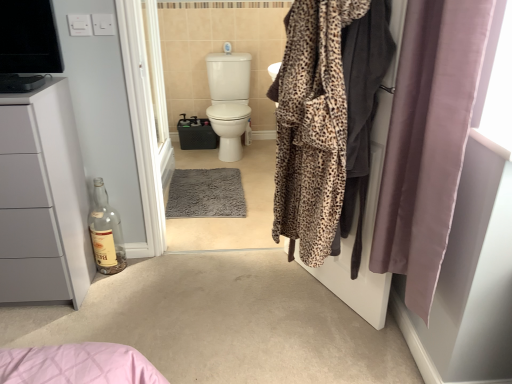
Describe the element at coordinates (42, 197) in the screenshot. I see `matte white cabinet at left` at that location.

In order to click on matte white cabinet at left in this screenshot , I will do `click(42, 197)`.

What are the coordinates of `white glossy screen door at center, acting as the second screen door starting from the front` in the screenshot? It's located at (146, 118).

At what (x,y) coordinates should I click in order to perform the action: click on leopard print robe at center, the first screen door in the right-to-left sequence. Please return your answer as a coordinate pair (x, y). This screenshot has height=384, width=512. Looking at the image, I should click on (x=362, y=242).

You are a GUI agent. You are given a task and a screenshot of the screen. Output one action in this format:
    pyautogui.click(x=<x>, y=<y>)
    Task: Click on the bathroom cabinet below the leopard print robe at center, the second screen door when ordered from back to front (from a real-world perspective)
    This screenshot has width=512, height=384.
    Given the screenshot: What is the action you would take?
    pyautogui.click(x=42, y=197)

Which of these two, matte white cabinet at left or leopard print robe at center, the first screen door in the right-to-left sequence, stands shorter?

matte white cabinet at left.

Which is more distant, (23, 129) or (350, 241)?

The point (350, 241) is farther from the camera.

Is matte white cabinet at left situated inside leopard print robe at center, positioned as the first screen door in front-to-back order, or outside?

matte white cabinet at left is not inside leopard print robe at center, positioned as the first screen door in front-to-back order, it's outside.

Is clear glass bottle at lower left not near white glossy toilet at center?

Yes.

Between clear glass bottle at lower left and white glossy toilet at center, which one has more height?

Standing taller between the two is white glossy toilet at center.

How much distance is there between clear glass bottle at lower left and white glossy toilet at center?

They are 1.90 meters apart.

Between clear glass bottle at lower left and white glossy toilet at center, which one has larger width?

With larger width is white glossy toilet at center.

Which is more to the left, matte white cabinet at left or white glossy screen door at center, marked as the 2th screen door in a right-to-left arrangement?

matte white cabinet at left is more to the left.

From a real-world perspective, count 1st screen doors upward from the matte white cabinet at left and point to it. Please provide its 2D coordinates.

[(146, 118)]

From the image's perspective, is matte white cabinet at left located above white glossy screen door at center, marked as the 2th screen door in a right-to-left arrangement?

No.

Is matte white cabinet at left not close to white glossy screen door at center, the first screen door when ordered from back to front?

No, matte white cabinet at left is in close proximity to white glossy screen door at center, the first screen door when ordered from back to front.

Between leopard print robe at center, positioned as the first screen door in front-to-back order, and leopard print robe at right, which one has less height?

leopard print robe at center, positioned as the first screen door in front-to-back order.

Is leopard print robe at center, the second screen door when ordered from back to front, to the right of leopard print robe at right from the viewer's perspective?

Answer: In fact, leopard print robe at center, the second screen door when ordered from back to front, is to the left of leopard print robe at right.

The width and height of the screenshot is (512, 384). Find the location of `clothing below the leopard print robe at center, which is the second screen door from left to right (from the image's perspective)`. clothing below the leopard print robe at center, which is the second screen door from left to right (from the image's perspective) is located at coordinates (361, 111).

Between white glossy toilet at center and silky mauve curtain at right, which one has less height?

Standing shorter between the two is white glossy toilet at center.

Is white glossy toilet at center at the left side of silky mauve curtain at right?

Yes, white glossy toilet at center is to the left of silky mauve curtain at right.

Which is behind, point (230, 116) or point (481, 28)?

Positioned behind is point (230, 116).

Find the location of a particular element. This screenshot has height=384, width=512. toilet on the left of silky mauve curtain at right is located at coordinates (229, 100).

Could you tell me if white glossy toilet at center is turned towards leopard print robe at center, which is the second screen door from left to right?

Yes, white glossy toilet at center faces towards leopard print robe at center, which is the second screen door from left to right.

From the image's perspective, is white glossy toilet at center on leopard print robe at center, positioned as the first screen door in front-to-back order?

Yes.

From the image's perspective, count 2nd screen doors downward from the white glossy toilet at center and point to it. Please provide its 2D coordinates.

[(362, 242)]

From a real-world perspective, which object rests below the other?

clear glass bottle at lower left is physically lower.

Could you tell me if matte white cabinet at left is facing clear glass bottle at lower left?

No, matte white cabinet at left is not oriented towards clear glass bottle at lower left.

From the picture: In terms of height, does matte white cabinet at left look taller or shorter compared to clear glass bottle at lower left?

Considering their sizes, matte white cabinet at left has more height than clear glass bottle at lower left.

Considering the points (31, 287) and (102, 258), which point is behind, point (31, 287) or point (102, 258)?

The point (102, 258) is more distant.

Locate an element on the screen. The image size is (512, 384). the 1st screen door above the matte white cabinet at left (from the image's perspective) is located at coordinates (362, 242).

Identify the location of toilet above the clear glass bottle at lower left (from a real-world perspective). The width and height of the screenshot is (512, 384). (229, 100).

Estimate the real-world distances between objects in this image. Which object is closer to white glossy screen door at center, marked as the 2th screen door in a right-to-left arrangement, leopard print robe at right or silky mauve curtain at right?

leopard print robe at right lies closer to white glossy screen door at center, marked as the 2th screen door in a right-to-left arrangement, than the other object.

Looking at this image, considering their positions, is white glossy toilet at center positioned closer to matte white cabinet at left than leopard print robe at right?

leopard print robe at right is positioned closer to the anchor matte white cabinet at left.

Looking at the image, which one is located closer to silky mauve curtain at right, leopard print robe at right or leopard print robe at center, the second screen door when ordered from back to front?

The object closer to silky mauve curtain at right is leopard print robe at center, the second screen door when ordered from back to front.

Looking at the image, which one is located further to leopard print robe at center, the second screen door when ordered from back to front, silky mauve curtain at right or matte white cabinet at left?

matte white cabinet at left is further to leopard print robe at center, the second screen door when ordered from back to front.

Based on their spatial positions, is matte white cabinet at left or white glossy toilet at center further from leopard print robe at center, the first screen door in the right-to-left sequence?

white glossy toilet at center.

Looking at the image, which one is located further to leopard print robe at center, which is the second screen door from left to right, clear glass bottle at lower left or white glossy screen door at center, acting as the second screen door starting from the front?

clear glass bottle at lower left is positioned further to the anchor leopard print robe at center, which is the second screen door from left to right.

Looking at the image, which one is located closer to silky mauve curtain at right, white glossy toilet at center or white glossy screen door at center, acting as the second screen door starting from the front?

Among the two, white glossy screen door at center, acting as the second screen door starting from the front, is located nearer to silky mauve curtain at right.

Estimate the real-world distances between objects in this image. Which object is further from clear glass bottle at lower left, white glossy screen door at center, acting as the second screen door starting from the front, or leopard print robe at right?

The object further to clear glass bottle at lower left is leopard print robe at right.

Where is `screen door located between silky mauve curtain at right and white glossy screen door at center, acting as the second screen door starting from the front, in the depth direction`? This screenshot has height=384, width=512. screen door located between silky mauve curtain at right and white glossy screen door at center, acting as the second screen door starting from the front, in the depth direction is located at coordinates (362, 242).

Locate an element on the screen. This screenshot has height=384, width=512. bottle positioned between silky mauve curtain at right and white glossy toilet at center from near to far is located at coordinates (106, 233).

This screenshot has width=512, height=384. Find the location of `screen door between leopard print robe at right and white glossy toilet at center along the z-axis`. screen door between leopard print robe at right and white glossy toilet at center along the z-axis is located at coordinates (146, 118).

At what (x,y) coordinates should I click in order to perform the action: click on bathroom cabinet between white glossy screen door at center, the first screen door when ordered from back to front, and clear glass bottle at lower left vertically. Please return your answer as a coordinate pair (x, y). Looking at the image, I should click on (42, 197).